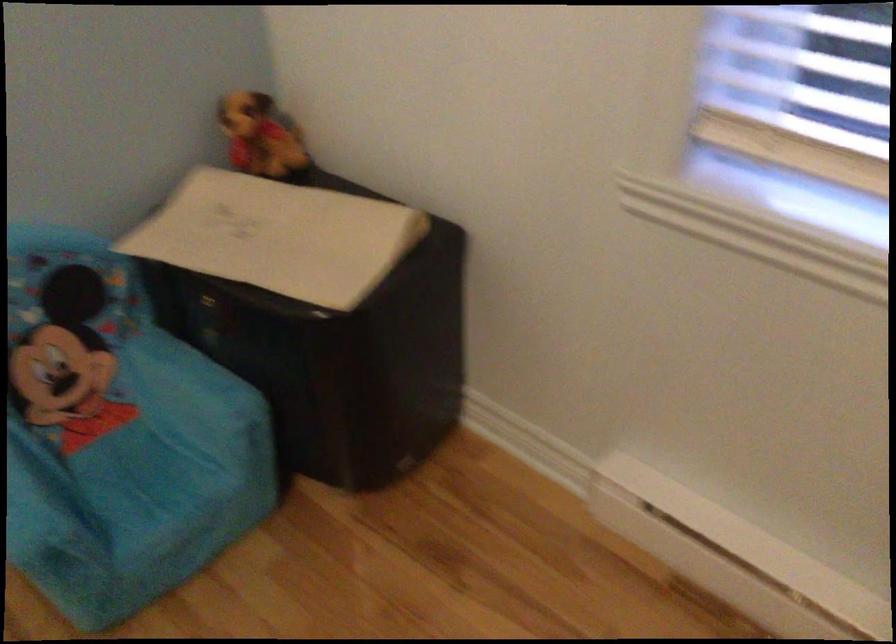
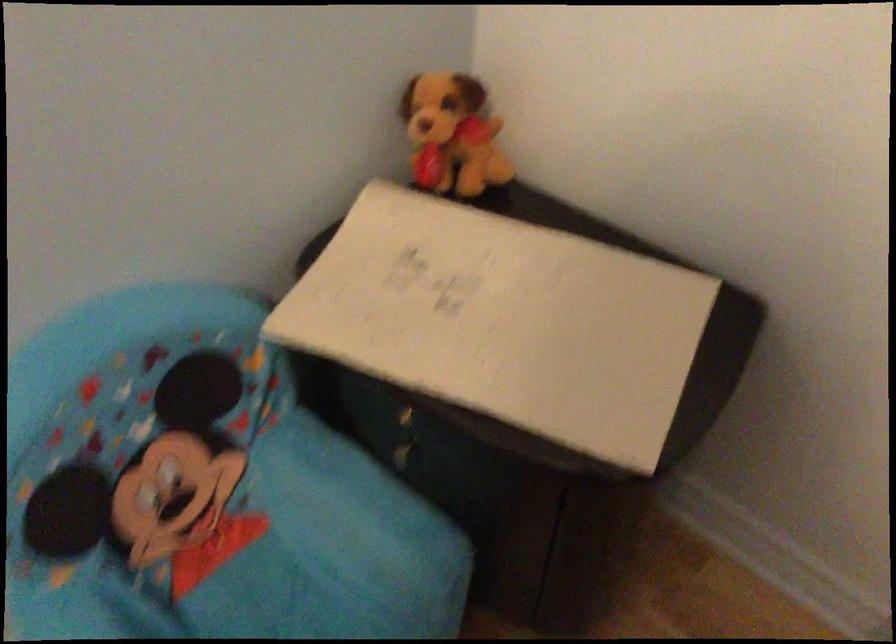
Locate, in the second image, the point that corresponds to (x=97, y=436) in the first image.

(220, 554)